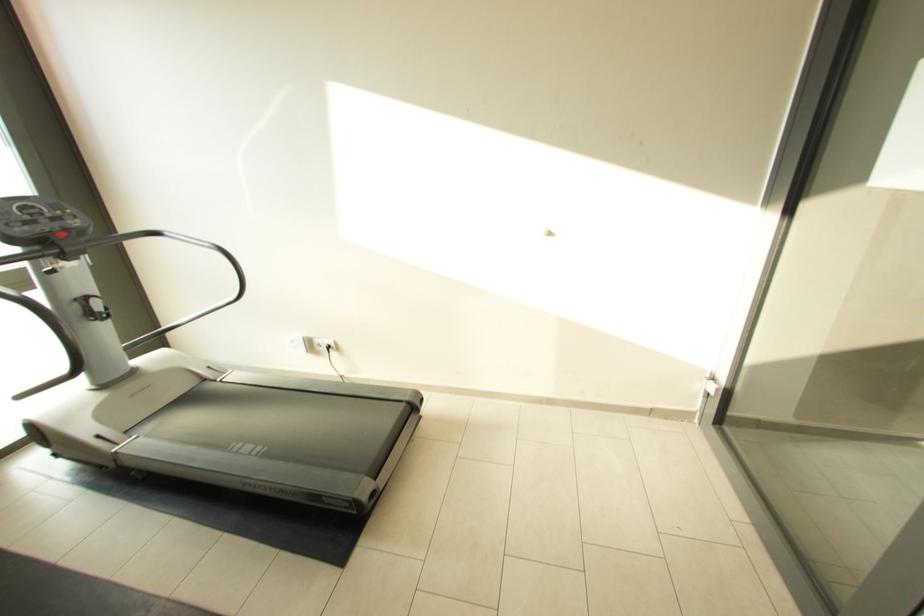
Describe the element at coordinates (323, 344) in the screenshot. The image size is (924, 616). I see `a power outlet socket` at that location.